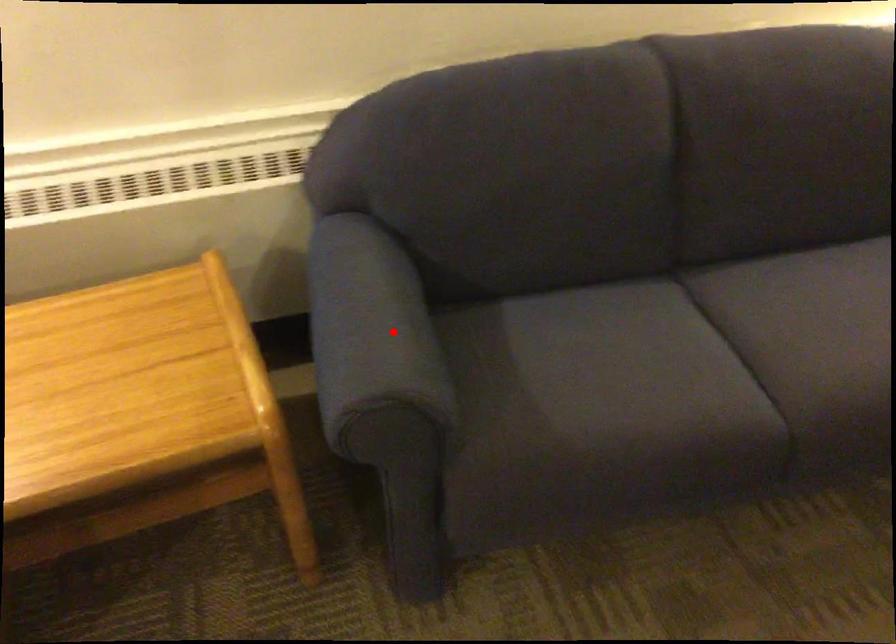
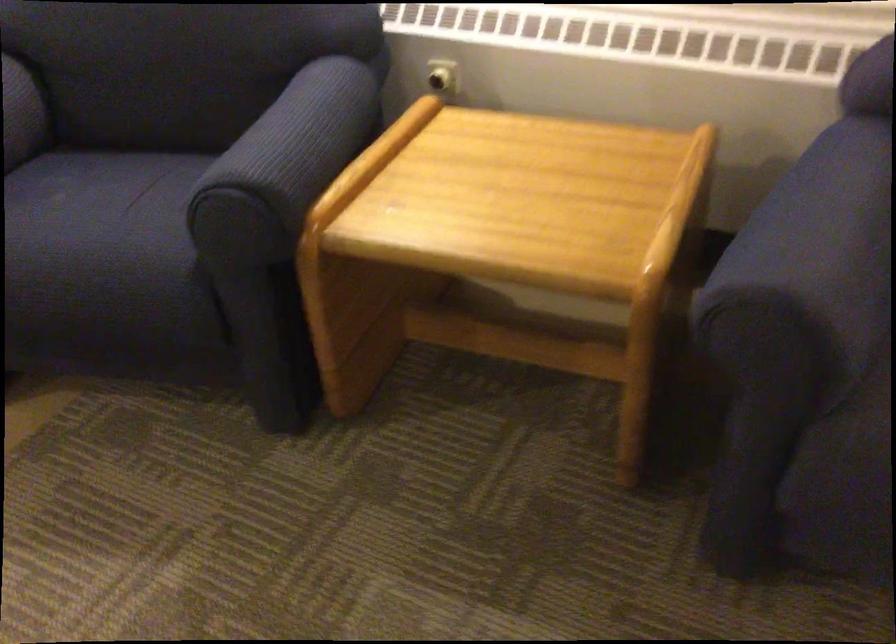
Locate, in the second image, the point that corresponds to the highlighted location in the first image.

(821, 238)